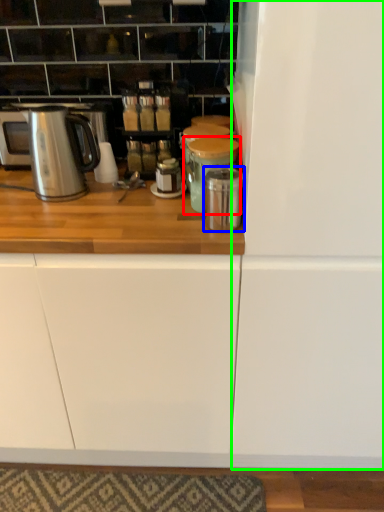
Question: Considering the real-world distances, which object is closest to appliance (highlighted by a red box)? appliance (highlighted by a blue box) or fridge (highlighted by a green box).

Choices:
 (A) appliance
 (B) fridge

Answer: (A)